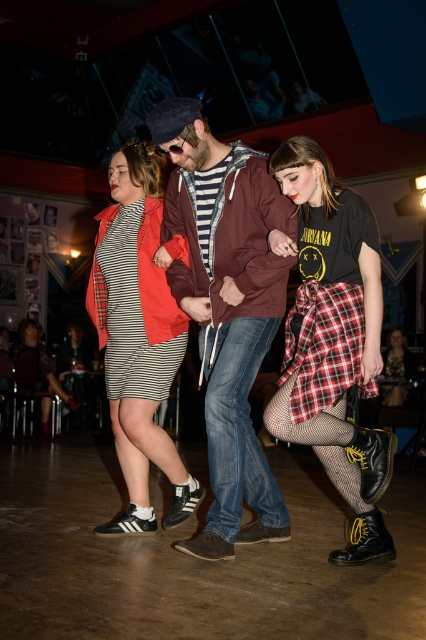
You are a photographer trying to capture the best shot of the dancing scene. You want to focus on the matte black shoes at center. Where should you aim your camera to ensure the shoes are in the frame?

You should aim your camera at point 0.481 on the x axis and 0.533 on the y axis to ensure the matte black shoes at center are in the frame.

You are a photographer trying to capture a candid shot of the matte maroon hoodie at center and the plaid fabric skirt at lower right. Since you want to focus on both subjects equally, will you need to adjust your camera angle to ensure both are fully visible in the frame?

The matte maroon hoodie at center is in front of the plaid fabric skirt at lower right, so you will need to adjust your camera angle to ensure both are fully visible in the frame.

You are standing in the room and see two points in the scene. The first point is at coordinates point (x=196, y=314) and the second point is at point (x=304, y=362). Which point is closer to you?

Point (x=196, y=314) is further to the camera than point (x=304, y=362), so the second point is closer to you.